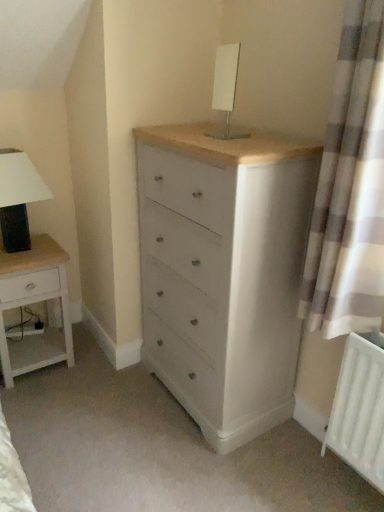
Find the location of a particular element. This screenshot has width=384, height=512. vacant space in between matte white chest of drawers at center and white matte radiator at lower right is located at coordinates (290, 459).